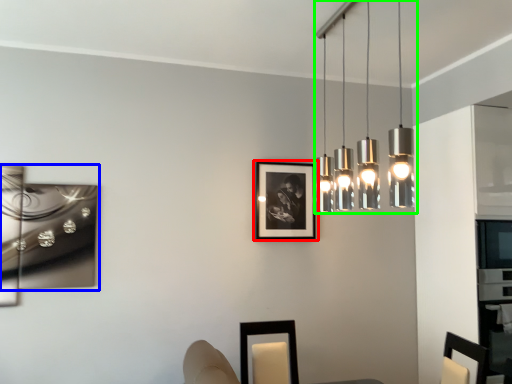
Question: Estimate the real-world distances between objects in this image. Which object is closer to picture frame (highlighted by a red box), picture frame (highlighted by a blue box) or lamp (highlighted by a green box)?

Choices:
 (A) picture frame
 (B) lamp

Answer: (B)